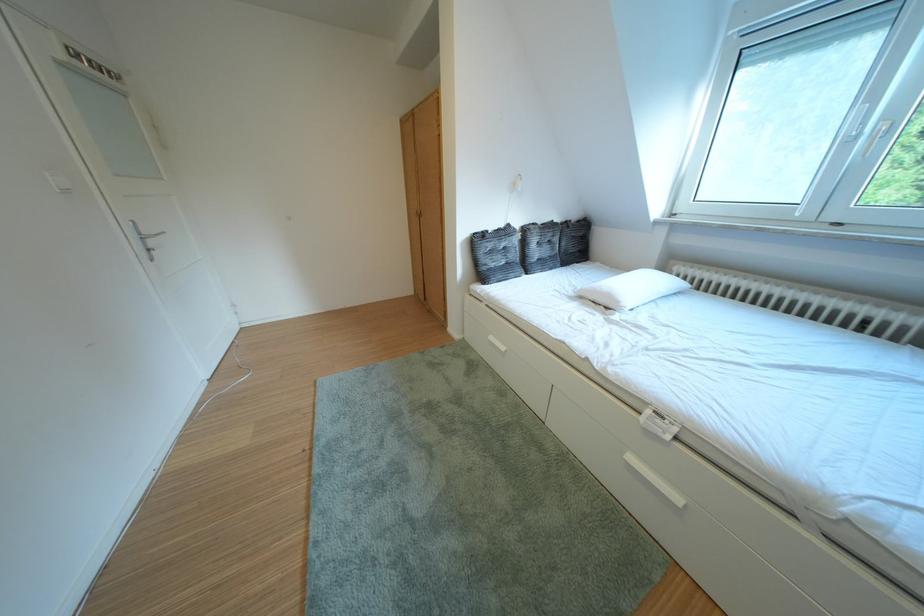
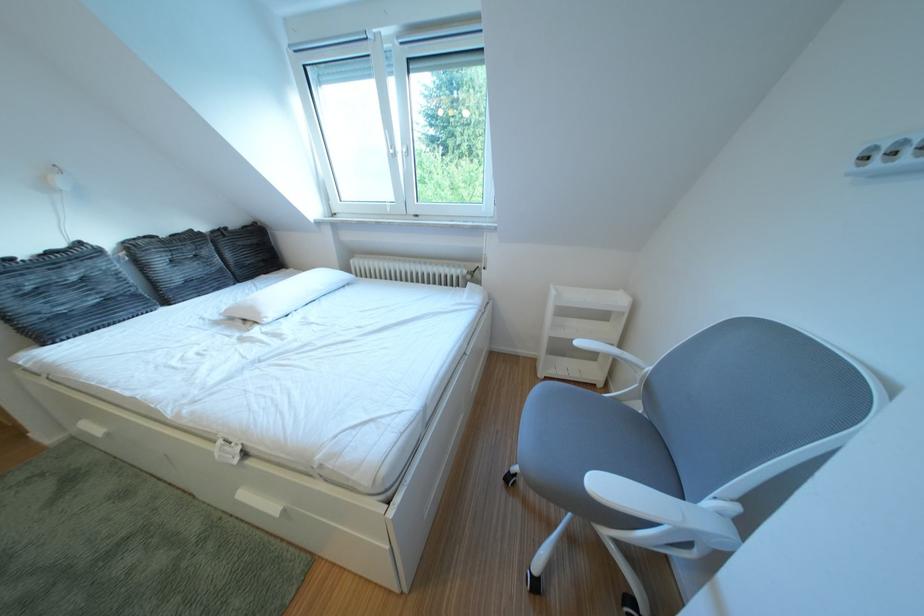
Where in the second image is the point corresponding to the point at 523,230 from the first image?

(93, 249)